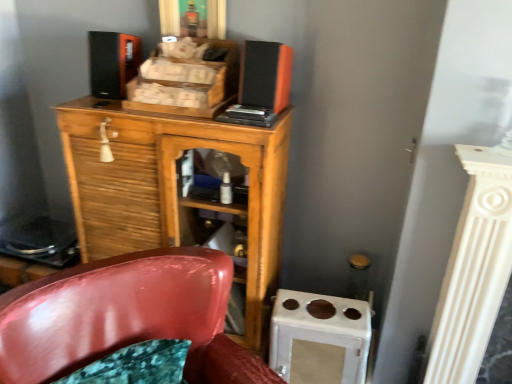
In order to click on free location in front of matte black speaker at upper center, which is the 1th speaker in right-to-left order in this screenshot , I will do `click(244, 122)`.